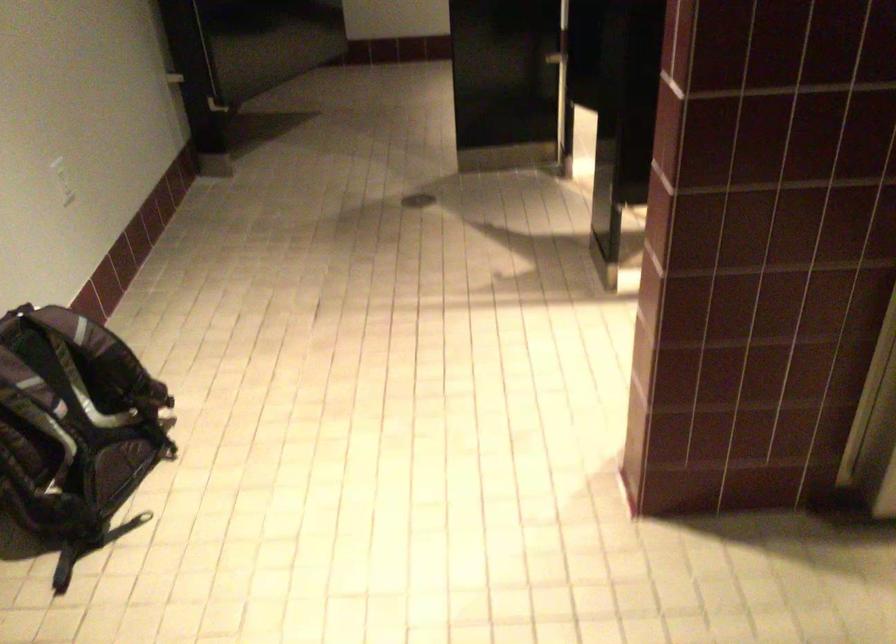
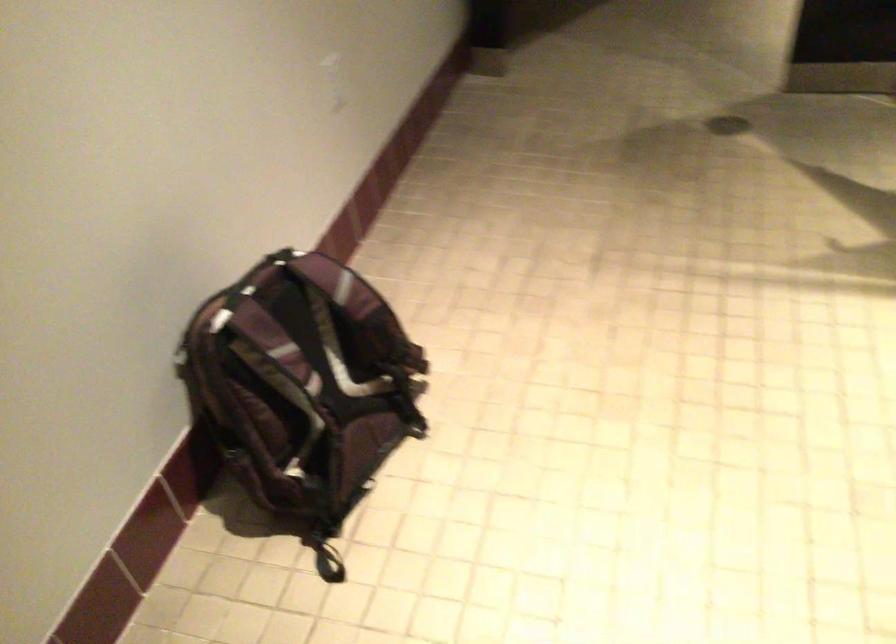
Find the pixel in the second image that matches pixel 142 422 in the first image.

(393, 393)